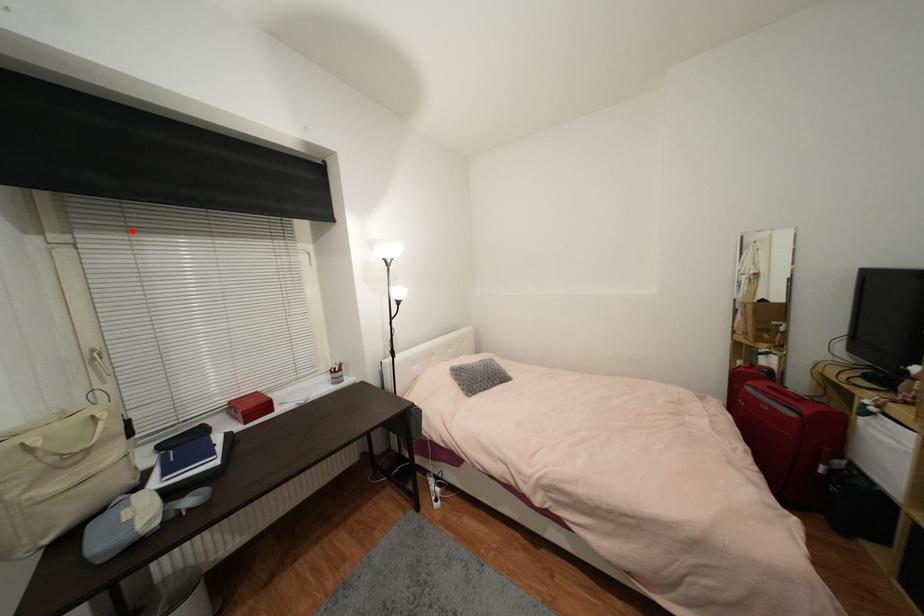
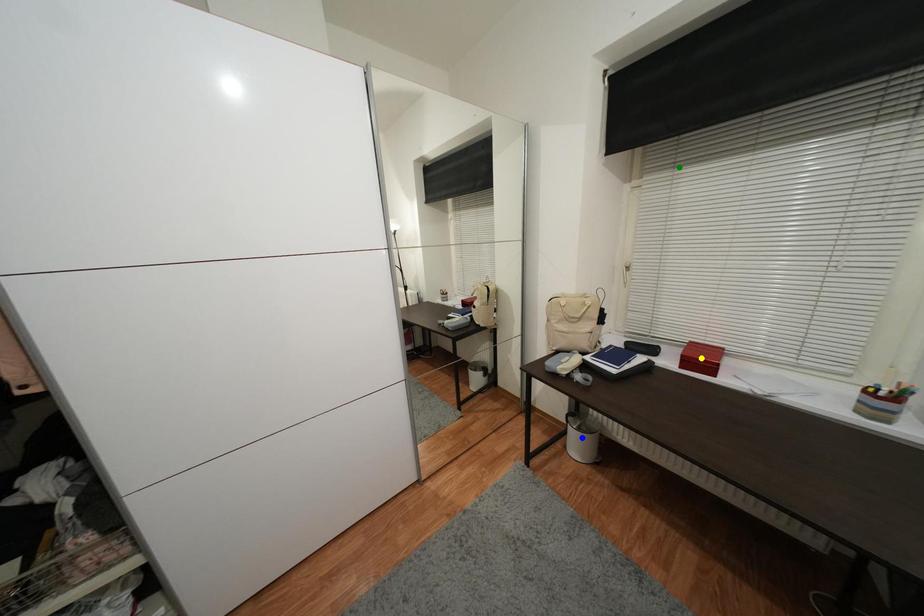
Question: I am providing you with two images of the same scene from different viewpoints. A red point is marked on the first image. You are given multiple points on the second image. Which spot in image 2 lines up with the point in image 1?

Choices:
 (A) green point
 (B) yellow point
 (C) blue point

Answer: (A)